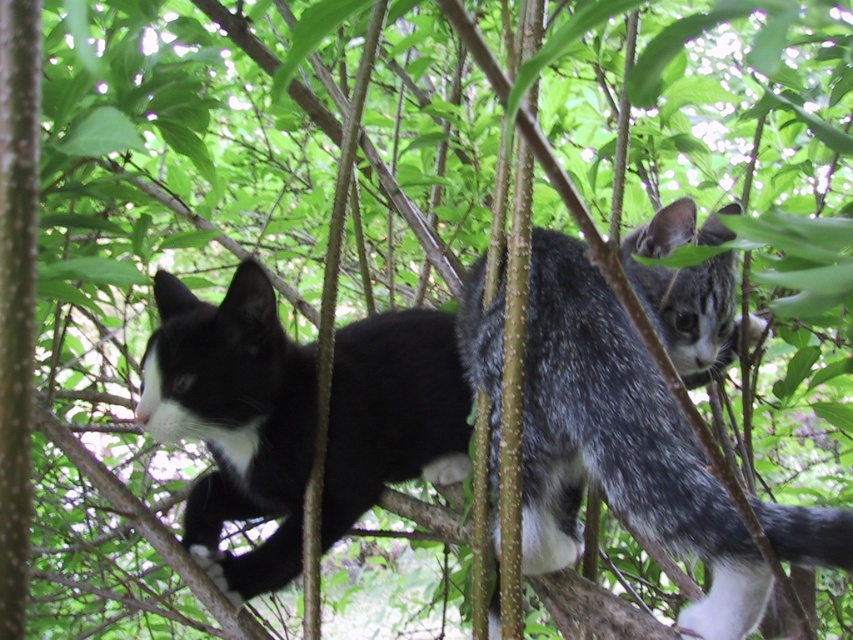
At what (x,y) coordinates should I click in order to perform the action: click on gray speckled fur cat at upper right. Please return your answer as a coordinate pair (x, y). Looking at the image, I should click on (619, 444).

Does point (701, 497) come behind point (213, 496)?

No.

Based on the photo, who is more distant from viewer, (703, 291) or (186, 400)?

Point (703, 291)

Where is `gray speckled fur cat at upper right`? gray speckled fur cat at upper right is located at coordinates (619, 444).